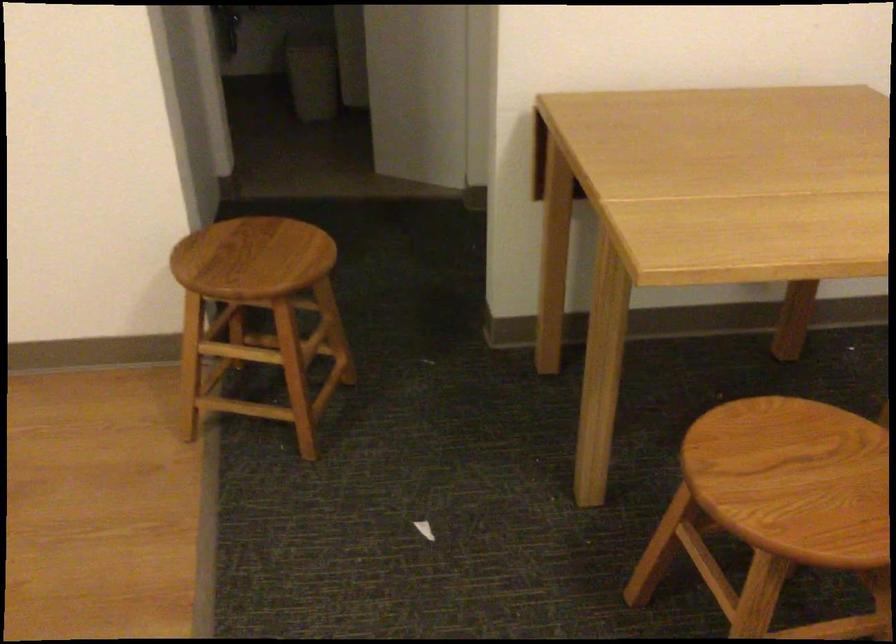
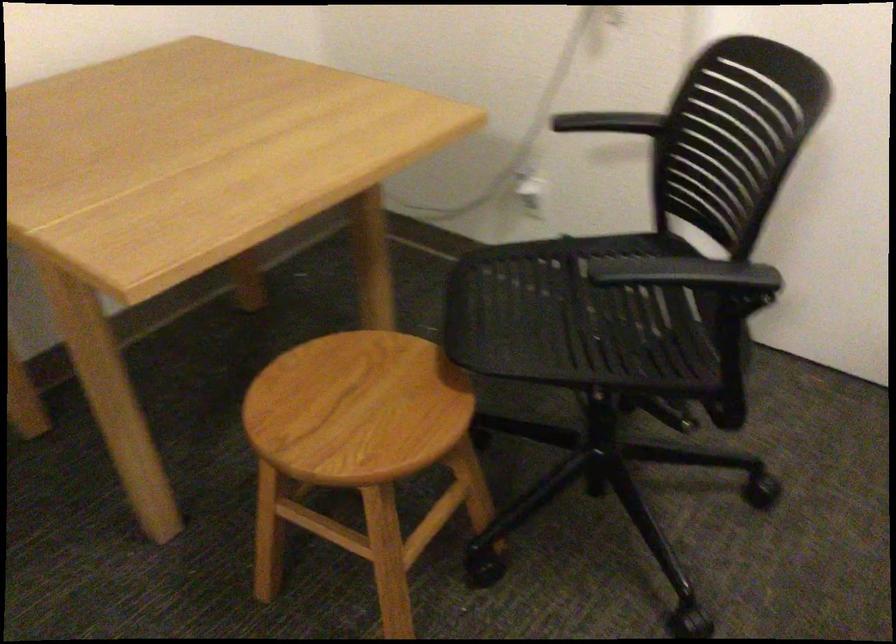
Question: I am providing you with two images of the same scene from different viewpoints. After the viewpoint changes to image2, which objects are now occluded?

Choices:
 (A) black chair armrest
 (B) black chair sitting surface
 (C) wooden chair sitting surface
 (D) none of these

Answer: (D)